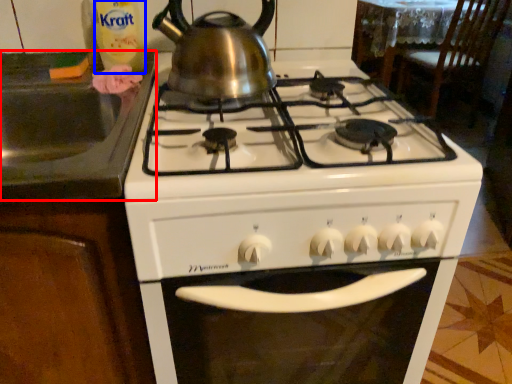
Question: Which object is further to the camera taking this photo, sink (highlighted by a red box) or bottle (highlighted by a blue box)?

Choices:
 (A) sink
 (B) bottle

Answer: (B)